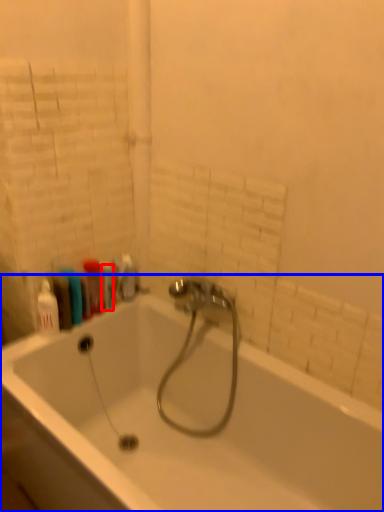
Question: Which object appears closest to the camera in this image, toiletry (highlighted by a red box) or bathtub (highlighted by a blue box)?

Choices:
 (A) toiletry
 (B) bathtub

Answer: (B)